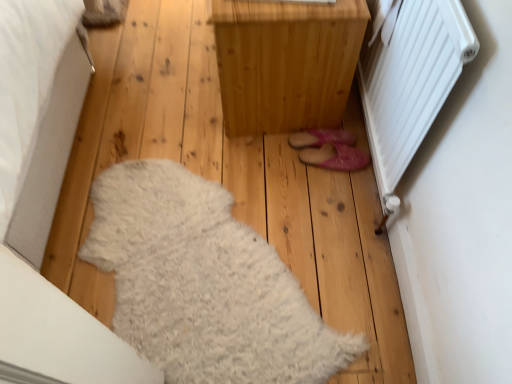
The width and height of the screenshot is (512, 384). In order to click on free space below pink fuzzy slippers at center (from a real-world perspective) in this screenshot , I will do `click(293, 156)`.